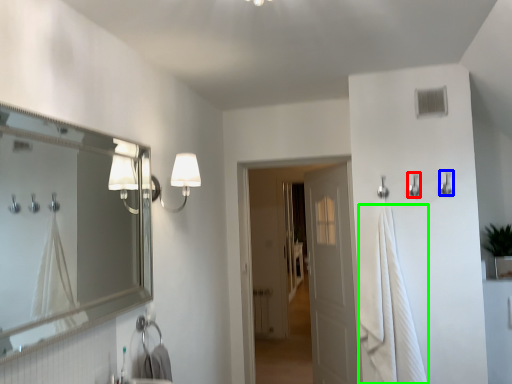
Question: Based on their relative distances, which object is nearer to shower (highlighted by a red box)? Choose from shower (highlighted by a blue box) and bath towel (highlighted by a green box).

Choices:
 (A) shower
 (B) bath towel

Answer: (A)